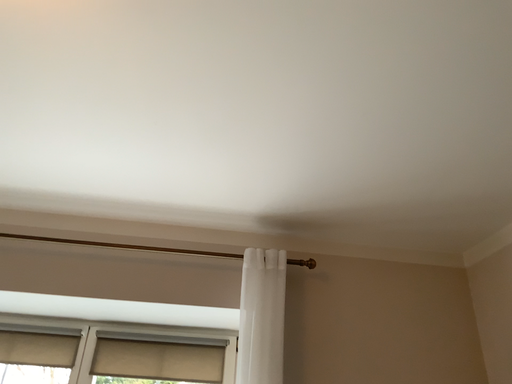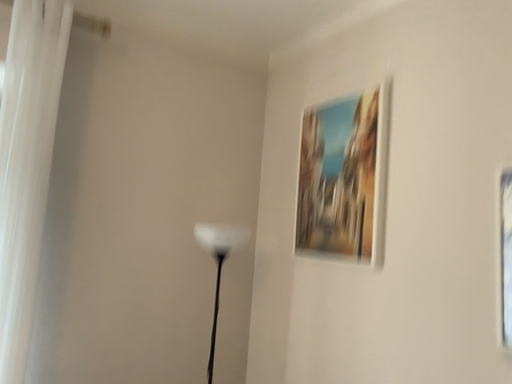
Question: Which way did the camera rotate in the video?

Choices:
 (A) rotated downward
 (B) rotated upward

Answer: (A)